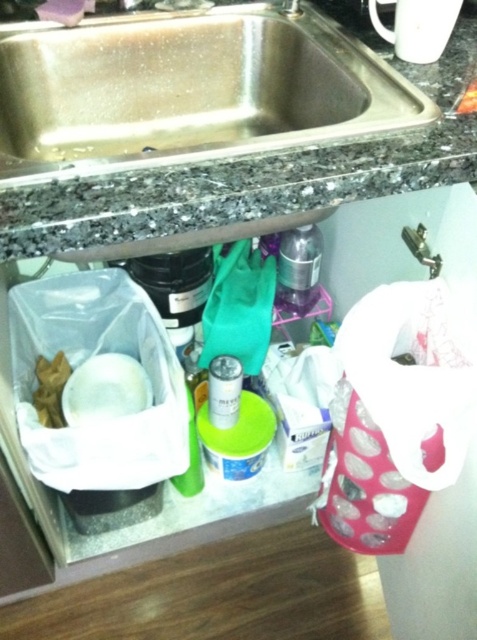
Image resolution: width=477 pixels, height=640 pixels. What do you see at coordinates (187, 90) in the screenshot?
I see `stainless steel sink at upper center` at bounding box center [187, 90].

Which is behind, point (103, 36) or point (208, 365)?

The point (208, 365) is behind.

Who is more forward, (260, 134) or (231, 406)?

Point (260, 134) is more forward.

This screenshot has width=477, height=640. Find the location of `stainless steel sink at upper center`. stainless steel sink at upper center is located at coordinates (187, 90).

Between stainless steel sink at upper center and metallic silver shaker at center-right, which one is positioned higher?

Positioned higher is stainless steel sink at upper center.

Is point (103, 134) in front of point (308, 257)?

Yes, point (103, 134) is closer to viewer.

Looking at this image, who is more forward, (x=208, y=147) or (x=306, y=268)?

Point (x=208, y=147) is in front.

Locate an element on the screen. stainless steel sink at upper center is located at coordinates (187, 90).

Does white dotted paper towel at right appear under metallic silver can at center?

No.

From the picture: Between white dotted paper towel at right and metallic silver can at center, which one is positioned lower?

metallic silver can at center is lower down.

Which is in front, point (364, 304) or point (209, 406)?

Point (364, 304) is in front.

Where is `white dotted paper towel at right`? white dotted paper towel at right is located at coordinates (414, 372).